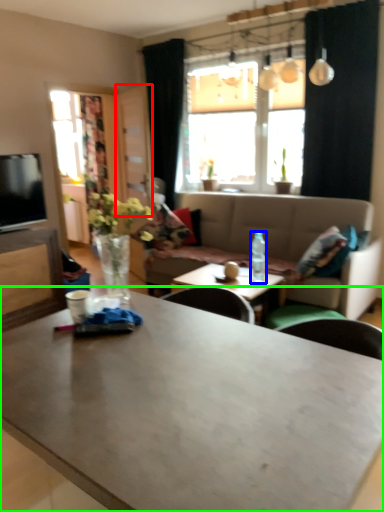
Question: Which is farther away from glass door (highlighted by a red box)? bottle (highlighted by a blue box) or coffee table (highlighted by a green box)?

Choices:
 (A) bottle
 (B) coffee table

Answer: (B)